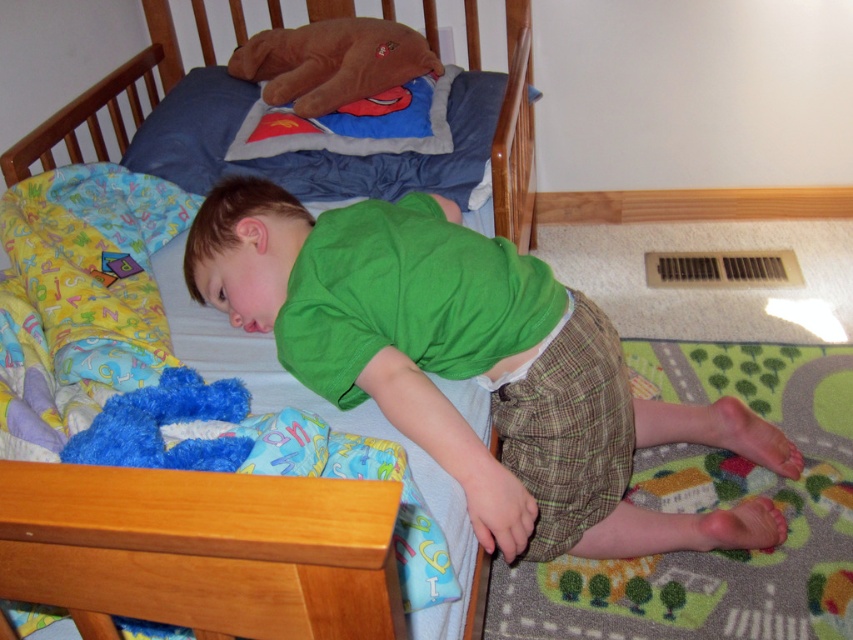
Is point (515, 538) farther from viewer compared to point (241, 440)?

Yes, point (515, 538) is behind point (241, 440).

Which is behind, point (227, 291) or point (91, 435)?

The point (227, 291) is more distant.

Identify the location of green cotton shirt at center. (471, 365).

Is wooden crib at upper left smaller than brown plush bear at upper center?

No, wooden crib at upper left is not smaller than brown plush bear at upper center.

Is point (431, 44) positioned behind point (277, 90)?

Yes, point (431, 44) is farther from viewer.

This screenshot has width=853, height=640. Find the location of `wooden crib at upper left`. wooden crib at upper left is located at coordinates (515, 134).

Is wooden crib at upper left in front of fuzzy blue stuffed animal at lower left?

No.

How distant is wooden crib at upper left from fuzzy blue stuffed animal at lower left?

96.78 centimeters

Between point (495, 138) and point (247, 451), which one is positioned behind?

Point (495, 138)

At what (x,y) coordinates should I click in order to perform the action: click on wooden crib at upper left. Please return your answer as a coordinate pair (x, y). The image size is (853, 640). Looking at the image, I should click on (515, 134).